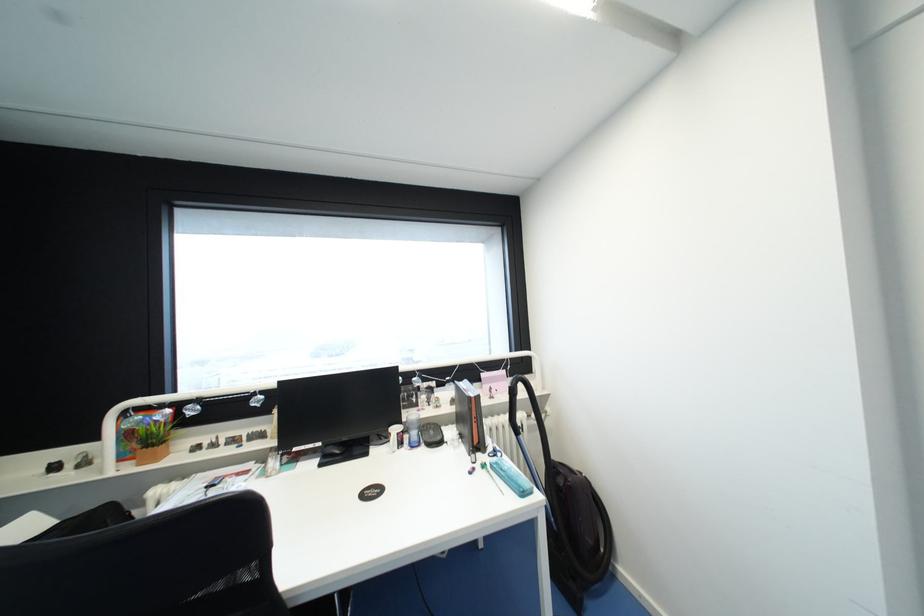
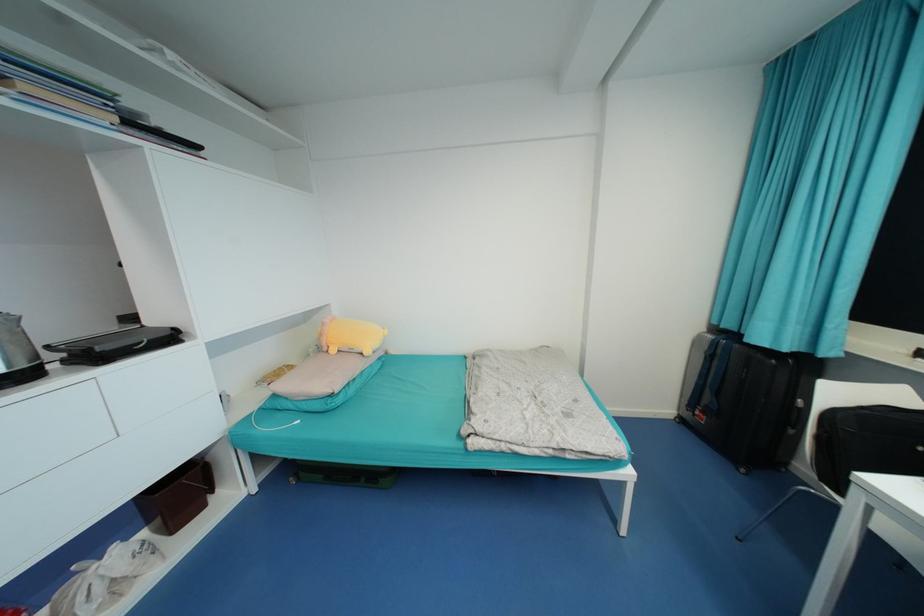
Based on the continuous images, in which direction is the camera rotating?

The camera's rotation is toward left-down.